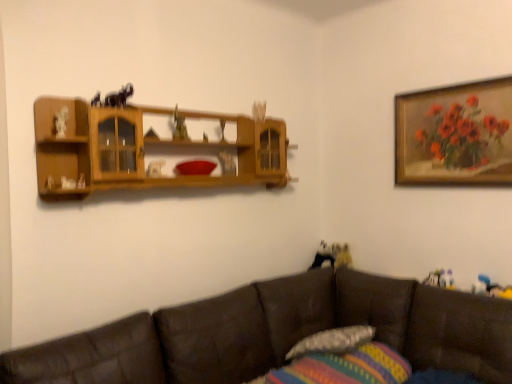
The height and width of the screenshot is (384, 512). I want to click on vacant area on top of wooden framed painting of flowers at upper right (from a real-world perspective), so click(449, 85).